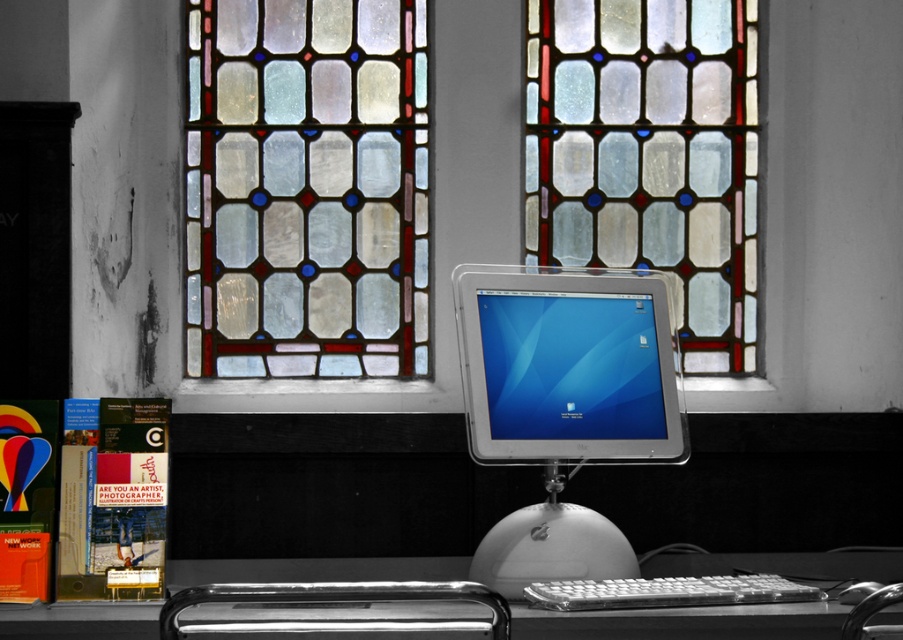
Can you confirm if white plastic computer desk at center is positioned above satin silver monitor at center?

No, white plastic computer desk at center is not above satin silver monitor at center.

Does point (728, 628) come closer to viewer compared to point (632, 406)?

Yes, point (728, 628) is in front of point (632, 406).

Where is `white plastic computer desk at center`? The image size is (903, 640). white plastic computer desk at center is located at coordinates (725, 605).

Does satin silver monitor at center appear on the left side of white plastic keyboard at lower center?

Indeed, satin silver monitor at center is positioned on the left side of white plastic keyboard at lower center.

Is point (632, 413) positioned before point (615, 593)?

That is False.

In the scene shown: Who is more distant from viewer, (582, 380) or (585, 588)?

Positioned behind is point (582, 380).

Find the location of `satin silver monitor at center`. satin silver monitor at center is located at coordinates (570, 365).

Which is behind, point (566, 276) or point (862, 588)?

Point (566, 276)

Is point (655, 380) positioned in front of point (855, 600)?

No.

I want to click on white plastic monitor at center, so coord(564,403).